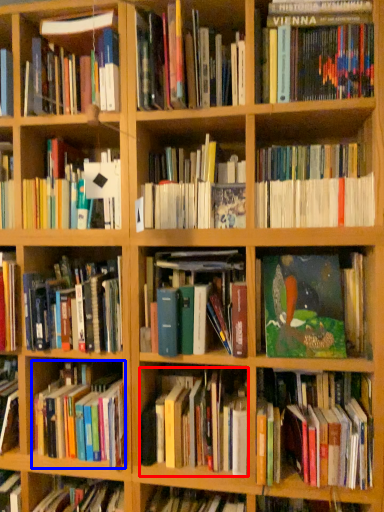
Question: Which of the following is the farthest to the observer, book (highlighted by a red box) or book (highlighted by a blue box)?

Choices:
 (A) book
 (B) book

Answer: (B)